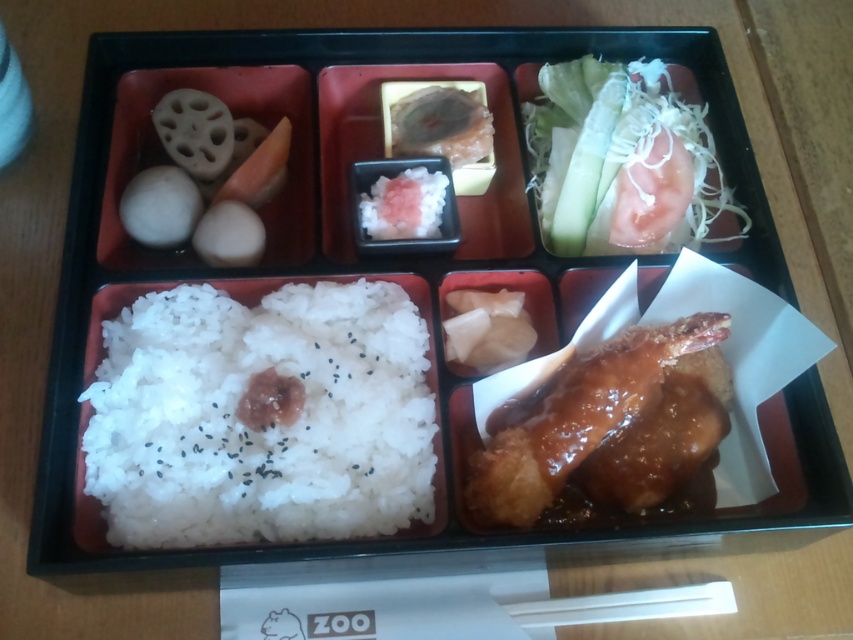
Question: Among these points, which one is farthest from the camera?

Choices:
 (A) (453, 157)
 (B) (146, 540)
 (C) (646, 605)
 (D) (519, 356)

Answer: (A)

Question: Is glossy brown chicken at bottom right positioned behind slightly translucent pinkish at center?

Choices:
 (A) yes
 (B) no

Answer: (B)

Question: Does slightly translucent pinkish at center have a greater width compared to white glossy pickled ginger at center?

Choices:
 (A) no
 (B) yes

Answer: (B)

Question: In this image, where is white shredded vegetable at upper right located relative to white glossy pickled ginger at center?

Choices:
 (A) left
 (B) right

Answer: (B)

Question: Which object is farther from the camera taking this photo?

Choices:
 (A) white matte rice at center
 (B) white shredded vegetable at upper right
 (C) glossy brown chicken at bottom right
 (D) slightly translucent pinkish at center

Answer: (D)

Question: Which point is farther from the camera taking this photo?

Choices:
 (A) (438, 92)
 (B) (421, 216)

Answer: (A)